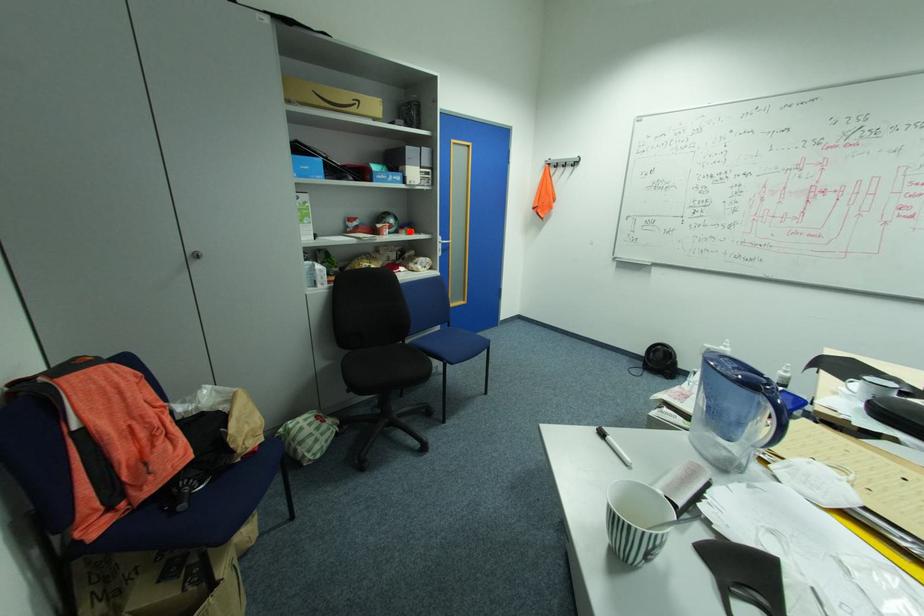
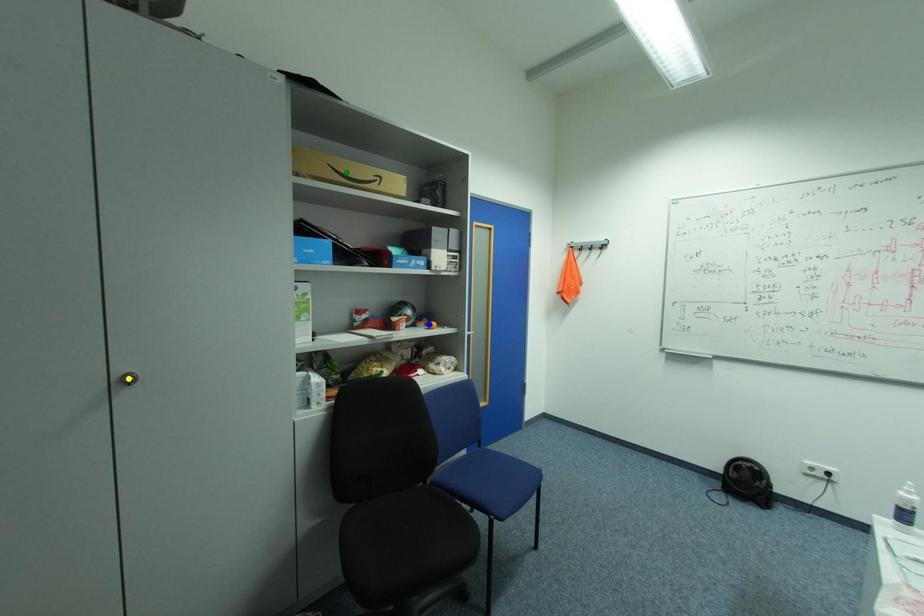
Question: I am providing you with two images of the same scene from different viewpoints. A red point is marked on the first image. You are given multiple points on the second image. Which mark in image 2 goes with the point in image 1?

Choices:
 (A) blue point
 (B) yellow point
 (C) green point

Answer: (A)